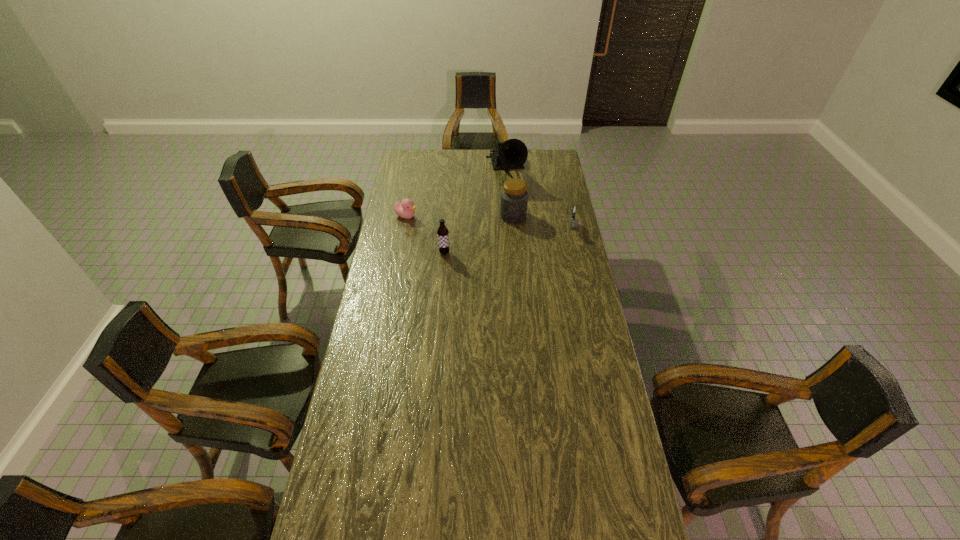
At what (x,y) coordinates should I click in order to perform the action: click on object present at the left edge. Please return your answer as a coordinate pair (x, y). Image resolution: width=960 pixels, height=540 pixels. Looking at the image, I should click on (405, 209).

In order to click on object positioned at the right edge in this screenshot , I will do `click(573, 209)`.

In the image, there is a desktop. Identify the location of vacant space at the left edge. (365, 485).

At what (x,y) coordinates should I click in order to perform the action: click on vacant area at the right edge of the desktop. Please return your answer as a coordinate pair (x, y). The width and height of the screenshot is (960, 540). Looking at the image, I should click on (570, 306).

At what (x,y) coordinates should I click in order to perform the action: click on vacant region between the rightmost object and the duckling. Please return your answer as a coordinate pair (x, y). This screenshot has width=960, height=540. Looking at the image, I should click on (490, 222).

Identify the location of free point between the leftmost object and the root beer. (425, 234).

Image resolution: width=960 pixels, height=540 pixels. Find the location of `free space between the rightmost object and the root beer`. free space between the rightmost object and the root beer is located at coordinates (508, 241).

Find the location of `vacant region between the farthest object and the duckling`. vacant region between the farthest object and the duckling is located at coordinates (456, 193).

Find the location of a particular element. Image resolution: width=960 pixels, height=540 pixels. free spot between the jar and the rightmost object is located at coordinates (542, 222).

Where is `free space between the leftmost object and the nearest object`? free space between the leftmost object and the nearest object is located at coordinates (425, 234).